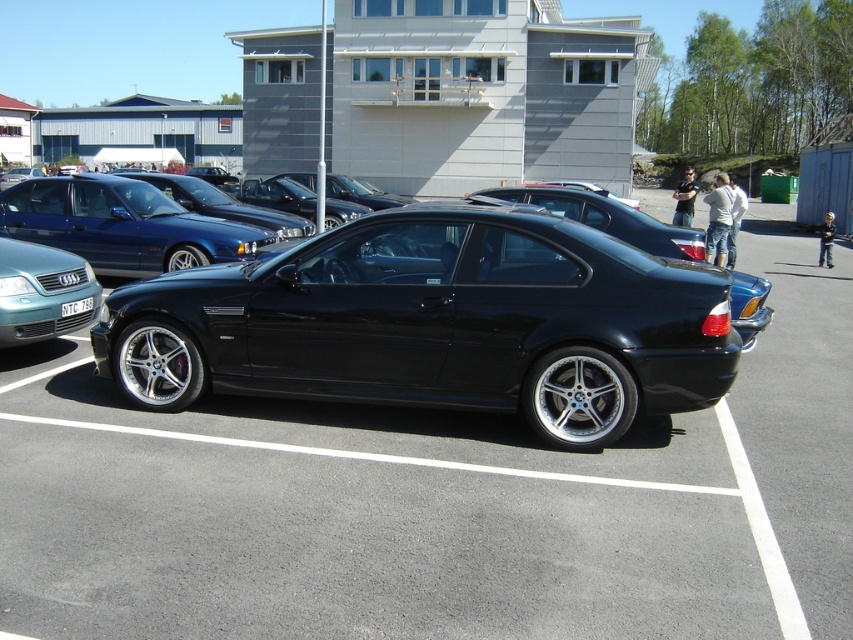
You are standing at the point with coordinates point (10, 218) and want to walk to the point with coordinates point (314, 376). Which direction should you move relative to the parking lot scene?

You should move forward because point (314, 376) is in front of point (10, 218).

You are a parking attendant and need to fit a new car into a parking spot that can only accommodate vehicles up to the width of the metallic blue sedan at left. Can the black metallic car at center currently parked in the spot be there legally?

The black metallic car at center has a larger width than the metallic blue sedan at left, so it cannot legally occupy the parking spot designated for vehicles up to the width of the metallic blue sedan at left.